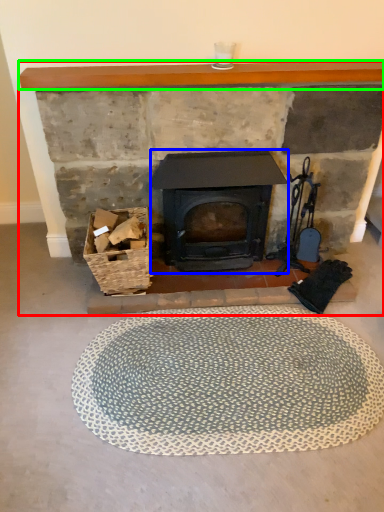
Question: Which object is the closest to the fireplace (highlighted by a red box)? Choose among these: wood burning stove (highlighted by a blue box) or balustrade (highlighted by a green box).

Choices:
 (A) wood burning stove
 (B) balustrade

Answer: (B)